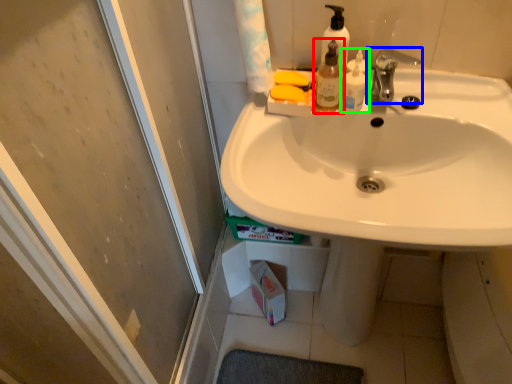
Question: Which is nearer to the mouthwash (highlighted by a red box)? tap (highlighted by a blue box) or mouthwash (highlighted by a green box).

Choices:
 (A) tap
 (B) mouthwash

Answer: (B)